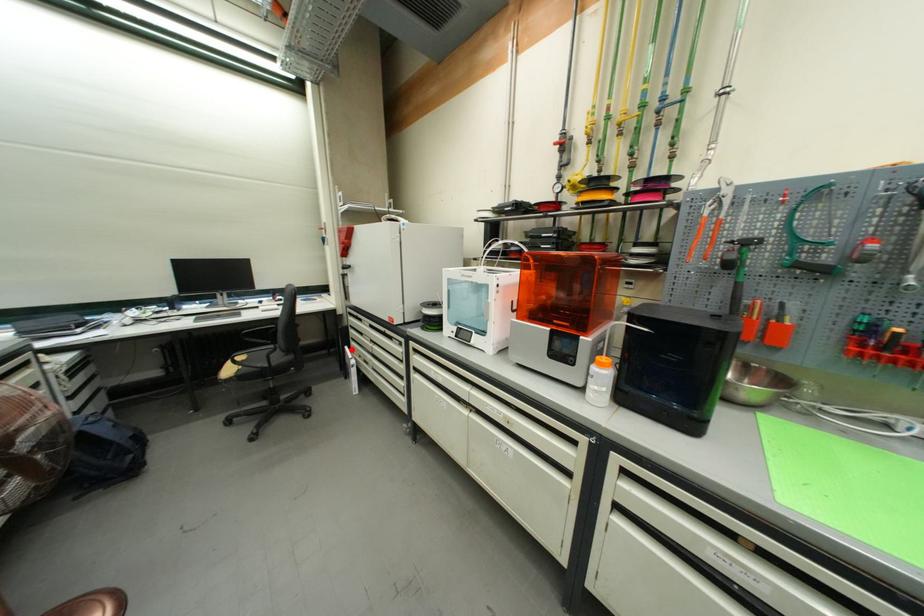
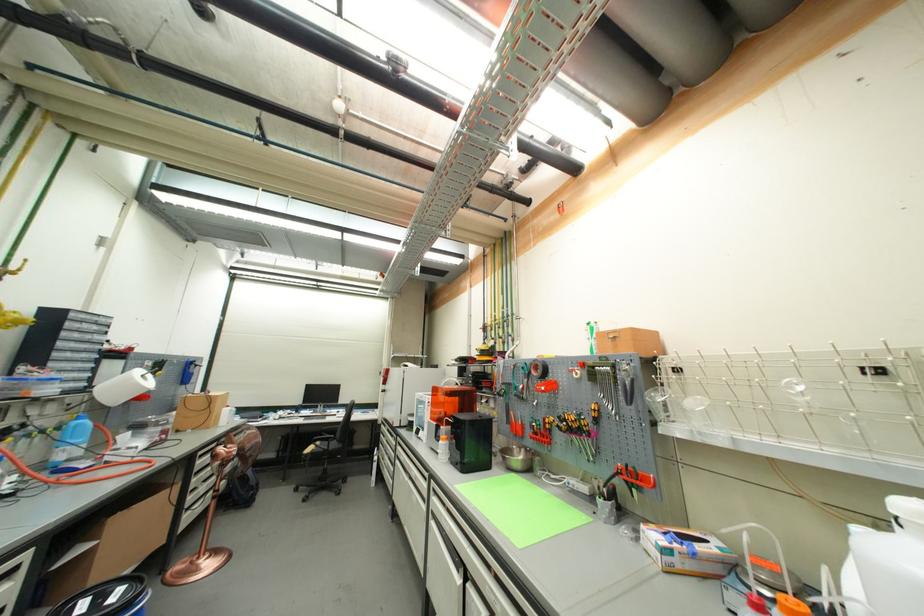
Where in the second image is the point corresponding to the highlighted location from the first image?

(382, 450)